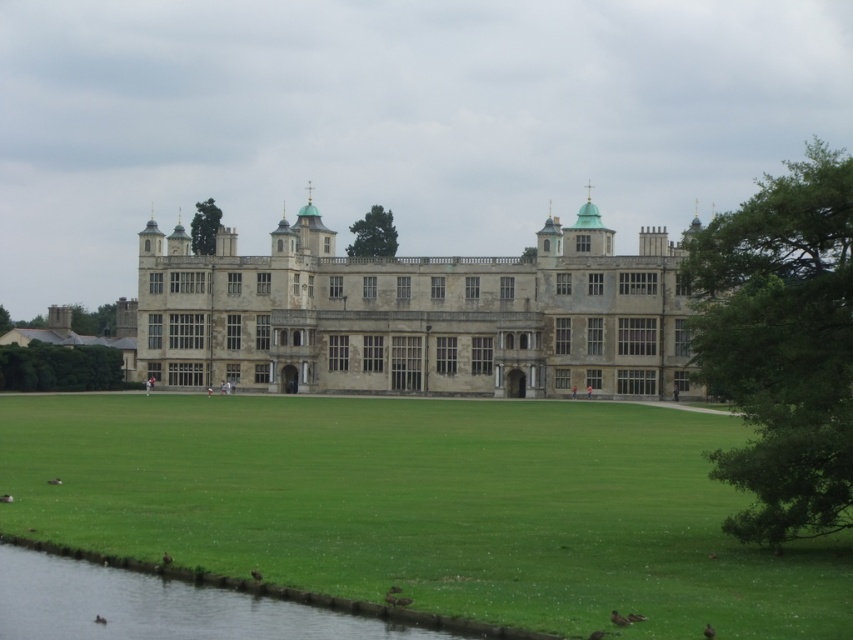
Question: Does green grass at center appear on the left side of green grassy river at lower left?

Choices:
 (A) no
 (B) yes

Answer: (A)

Question: Where is green grass at center located in relation to green grassy river at lower left in the image?

Choices:
 (A) above
 (B) below

Answer: (A)

Question: Which of the following is the closest to the observer?

Choices:
 (A) click(x=190, y=464)
 (B) click(x=13, y=577)

Answer: (B)

Question: Is the position of green grass at center less distant than that of green grassy river at lower left?

Choices:
 (A) no
 (B) yes

Answer: (B)

Question: Among these points, which one is farthest from the camera?

Choices:
 (A) (457, 426)
 (B) (187, 620)

Answer: (A)